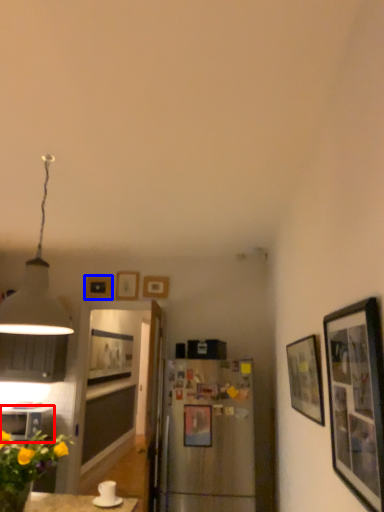
Question: Among these objects, which one is nearest to the camera, cabinetry (highlighted by a red box) or picture frame (highlighted by a blue box)?

Choices:
 (A) cabinetry
 (B) picture frame

Answer: (A)